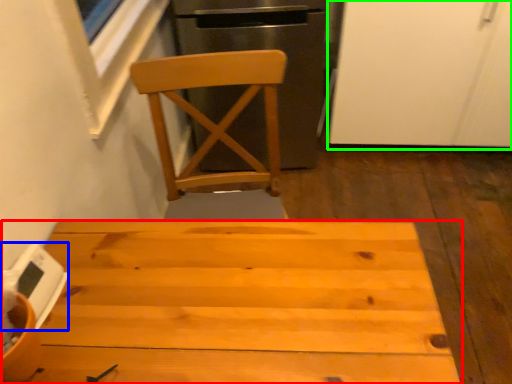
Question: Which is farther away from table (highlighted by a red box)? appliance (highlighted by a blue box) or screen door (highlighted by a green box)?

Choices:
 (A) appliance
 (B) screen door

Answer: (B)